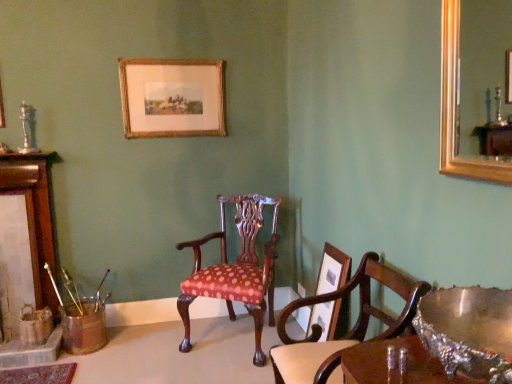
Question: Is brushed metal fireplace at left at the left side of polka dot fabric chair at center, which ranks as the 1th chair in back-to-front order?

Choices:
 (A) yes
 (B) no

Answer: (A)

Question: From a real-world perspective, does brushed metal fireplace at left stand above polka dot fabric chair at center, which ranks as the 1th chair in back-to-front order?

Choices:
 (A) no
 (B) yes

Answer: (B)

Question: Is brushed metal fireplace at left far from polka dot fabric chair at center, the 2th chair from the front?

Choices:
 (A) yes
 (B) no

Answer: (A)

Question: From a real-world perspective, is brushed metal fireplace at left located beneath polka dot fabric chair at center, the 2th chair from the front?

Choices:
 (A) no
 (B) yes

Answer: (A)

Question: Is brushed metal fireplace at left thinner than polka dot fabric chair at center, the 2th chair from the front?

Choices:
 (A) no
 (B) yes

Answer: (B)

Question: Is point pyautogui.click(x=465, y=326) closer or farther from the camera than point pyautogui.click(x=124, y=104)?

Choices:
 (A) closer
 (B) farther

Answer: (A)

Question: Relative to gold-framed print at upper center, marked as the first picture frame in a left-to-right arrangement, is shiny silver bowl at lower right in front or behind?

Choices:
 (A) front
 (B) behind

Answer: (A)

Question: Based on their sizes in the image, would you say shiny silver bowl at lower right is bigger or smaller than gold-framed print at upper center, the second picture frame viewed from the right?

Choices:
 (A) small
 (B) big

Answer: (B)

Question: In terms of height, does shiny silver bowl at lower right look taller or shorter compared to gold-framed print at upper center, which appears as the 2th picture frame when viewed from the front?

Choices:
 (A) tall
 (B) short

Answer: (B)

Question: In terms of width, does shiny silver bowl at lower right look wider or thinner when compared to wooden picture frame at center, the first picture frame from the bottom?

Choices:
 (A) thin
 (B) wide

Answer: (B)

Question: Would you say shiny silver bowl at lower right is inside or outside wooden picture frame at center, which appears as the second picture frame when viewed from the back?

Choices:
 (A) inside
 (B) outside

Answer: (B)

Question: From the image's perspective, is shiny silver bowl at lower right positioned above or below wooden picture frame at center, placed as the first picture frame when sorted from front to back?

Choices:
 (A) above
 (B) below

Answer: (A)

Question: From a real-world perspective, is shiny silver bowl at lower right positioned above or below wooden picture frame at center, placed as the first picture frame when sorted from front to back?

Choices:
 (A) below
 (B) above

Answer: (B)

Question: Would you say polka dot fabric chair at center, the 2th chair from the front, is to the left or to the right of wooden picture frame at center, arranged as the 1th picture frame when viewed from the right, in the picture?

Choices:
 (A) left
 (B) right

Answer: (A)

Question: Which is correct: polka dot fabric chair at center, which ranks as the 1th chair in back-to-front order, is inside wooden picture frame at center, placed as the first picture frame when sorted from front to back, or outside of it?

Choices:
 (A) outside
 (B) inside

Answer: (A)